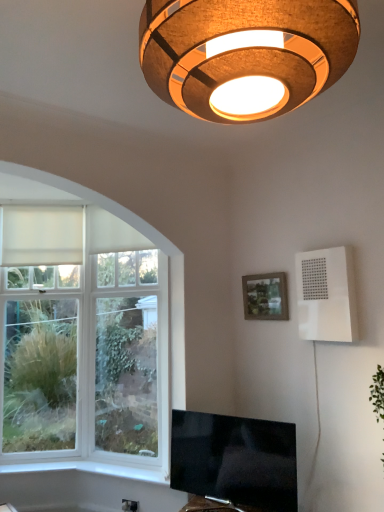
Question: Is white plastic electric outlet at lower center next to matte wooden picture frame at upper right?

Choices:
 (A) no
 (B) yes

Answer: (A)

Question: From the image's perspective, is white plastic electric outlet at lower center above matte wooden picture frame at upper right?

Choices:
 (A) no
 (B) yes

Answer: (A)

Question: Is white plastic electric outlet at lower center to the right of matte wooden picture frame at upper right from the viewer's perspective?

Choices:
 (A) no
 (B) yes

Answer: (A)

Question: Does white plastic electric outlet at lower center have a lesser height compared to matte wooden picture frame at upper right?

Choices:
 (A) yes
 (B) no

Answer: (A)

Question: Would you say white plastic electric outlet at lower center is outside matte wooden picture frame at upper right?

Choices:
 (A) yes
 (B) no

Answer: (A)

Question: Is white plastic electric outlet at lower center positioned in front of matte wooden picture frame at upper right?

Choices:
 (A) yes
 (B) no

Answer: (B)

Question: Is white plastic electric outlet at lower center completely or partially inside white plastic speaker at upper right?

Choices:
 (A) no
 (B) yes

Answer: (A)

Question: Does white plastic speaker at upper right have a larger size compared to white plastic electric outlet at lower center?

Choices:
 (A) no
 (B) yes

Answer: (B)

Question: From a real-world perspective, is white plastic speaker at upper right on white plastic electric outlet at lower center?

Choices:
 (A) no
 (B) yes

Answer: (B)

Question: Is white plastic speaker at upper right beside white plastic electric outlet at lower center?

Choices:
 (A) no
 (B) yes

Answer: (A)

Question: Is the position of white plastic speaker at upper right more distant than that of white plastic electric outlet at lower center?

Choices:
 (A) no
 (B) yes

Answer: (A)

Question: From the image's perspective, is white plastic speaker at upper right on white plastic electric outlet at lower center?

Choices:
 (A) no
 (B) yes

Answer: (B)

Question: Does flat-screen tv at lower center have a lesser width compared to matte wooden picture frame at upper right?

Choices:
 (A) no
 (B) yes

Answer: (A)